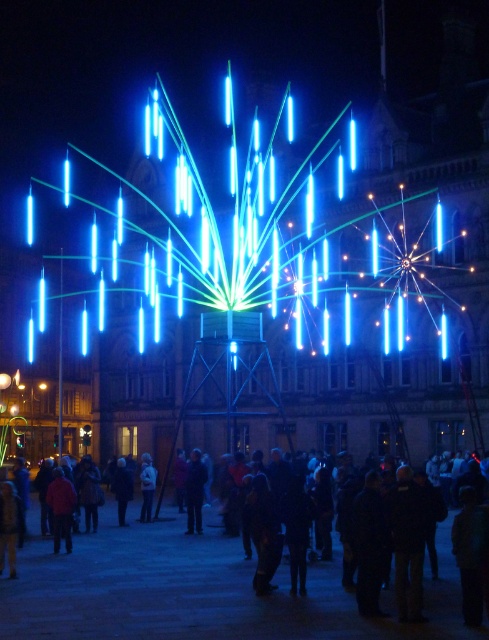
You are a photographer standing at the edge of the scene. You want to capture a clear shot of the dark blue fabric coat at lower center without the dark clothing crowd at center blocking it. Is there enough space between them to do this?

The dark clothing crowd at center might be wider than the dark blue fabric coat at lower center, so there may not be enough space to capture a clear shot without obstruction.

You are an event organizer planning to add a new light tube to the installation. You notice the dark clothing crowd at center and the dark blue fabric coat at lower center. Which object should you avoid placing the new light tube directly above to prevent casting shadows on the crowd?

You should avoid placing the new light tube directly above the dark clothing crowd at center because it is positioned under the dark blue fabric coat at lower center, meaning the coat could block the light from reaching the crowd below.